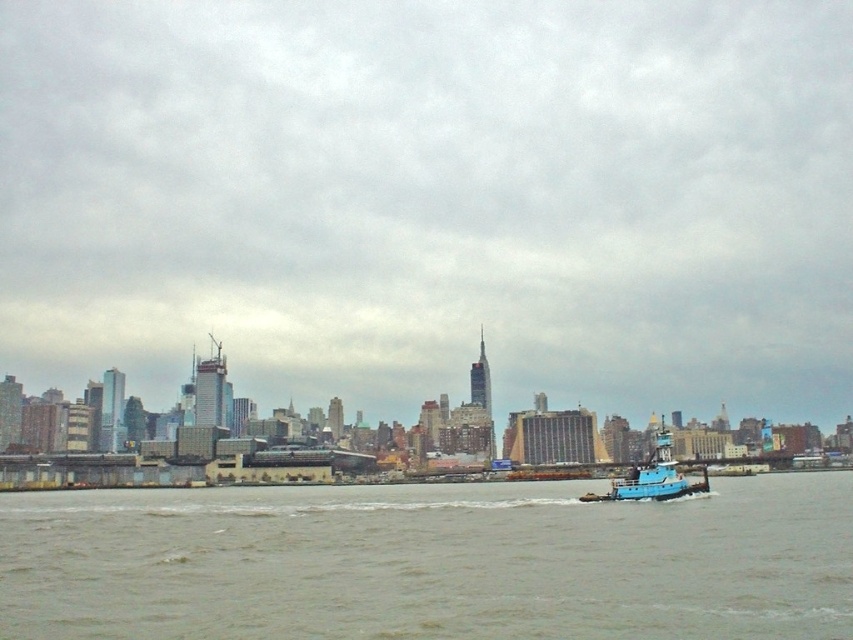
Does matte gray sky at center lie behind blue matte tugboat at lower right?

Yes, matte gray sky at center is behind blue matte tugboat at lower right.

How distant is matte gray sky at center from blue matte tugboat at lower right?

A distance of 164.29 meters exists between matte gray sky at center and blue matte tugboat at lower right.

Identify the location of matte gray sky at center. (433, 198).

Which is more to the left, matte gray sky at center or gray concrete river at lower center?

From the viewer's perspective, matte gray sky at center appears more on the left side.

Is point (796, 392) positioned in front of point (209, 500)?

No, (796, 392) is behind (209, 500).

At what (x,y) coordinates should I click in order to perform the action: click on matte gray sky at center. Please return your answer as a coordinate pair (x, y). The height and width of the screenshot is (640, 853). Looking at the image, I should click on (433, 198).

Who is taller, gray concrete river at lower center or blue matte tugboat at lower right?

gray concrete river at lower center is taller.

Who is positioned more to the right, gray concrete river at lower center or blue matte tugboat at lower right?

blue matte tugboat at lower right

Locate an element on the screen. gray concrete river at lower center is located at coordinates (428, 563).

The image size is (853, 640). In order to click on gray concrete river at lower center in this screenshot , I will do `click(428, 563)`.